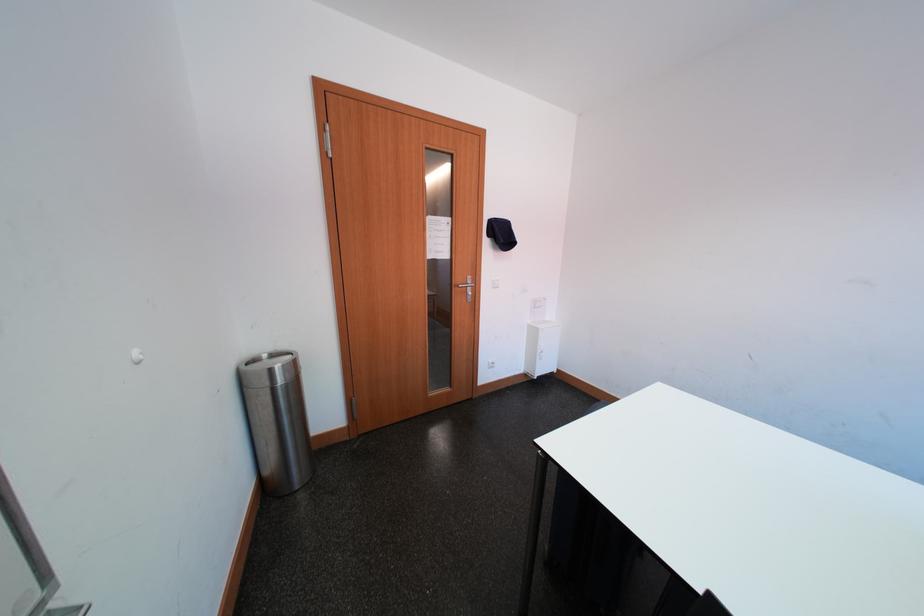
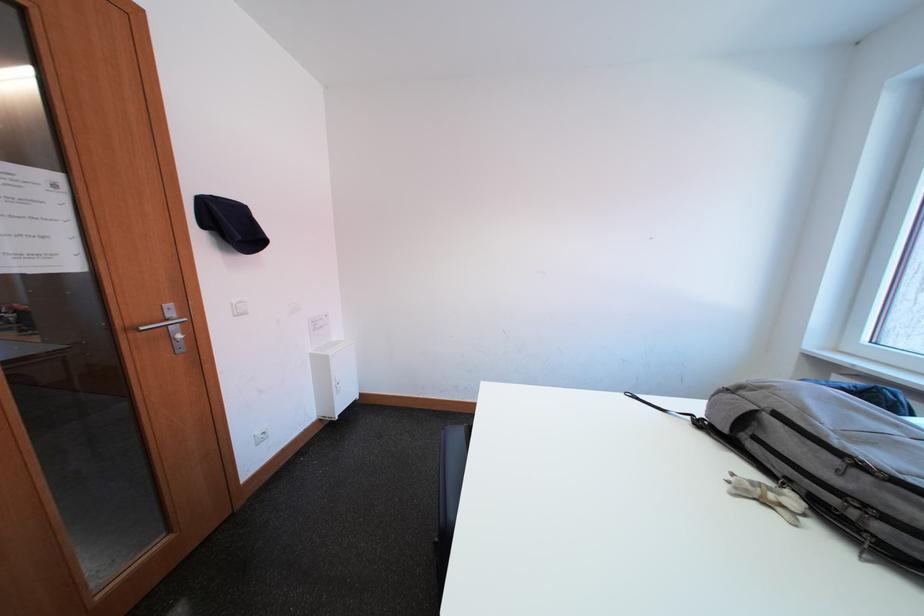
Question: The images are taken continuously from a first-person perspective. In which direction is your viewpoint rotating?

Choices:
 (A) Left
 (B) Right
 (C) Up
 (D) Down

Answer: (B)